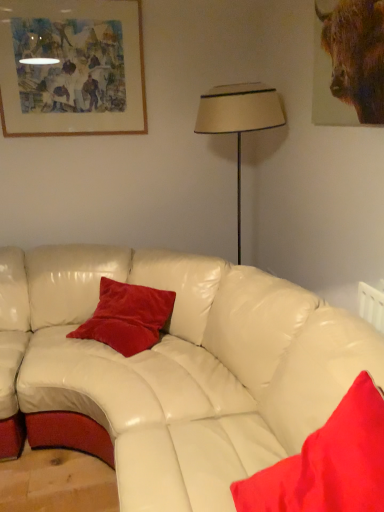
Describe the element at coordinates (348, 63) in the screenshot. I see `brown furry bull at upper right` at that location.

The height and width of the screenshot is (512, 384). I want to click on brown furry bull at upper right, so click(x=348, y=63).

What do you see at coordinates (71, 67) in the screenshot? Image resolution: width=384 pixels, height=512 pixels. I see `wooden framed artwork at upper left` at bounding box center [71, 67].

What do you see at coordinates (328, 463) in the screenshot? I see `velvet red pillow at lower right, the 1th pillow in the right-to-left sequence` at bounding box center [328, 463].

At what (x,y) coordinates should I click in order to perform the action: click on brown furry bull at upper right. Please return your answer as a coordinate pair (x, y). Looking at the image, I should click on (348, 63).

Is point (93, 126) more distant than point (350, 33)?

Yes, it is behind point (350, 33).

Locate an element on the screen. Image resolution: width=384 pixels, height=512 pixels. picture frame lying above the brown furry bull at upper right (from the image's perspective) is located at coordinates (71, 67).

Is wooden framed artwork at upper left placed right next to brown furry bull at upper right?

wooden framed artwork at upper left is not next to brown furry bull at upper right, and they're not touching.

Is beige fabric lampshade at center smaller than brown furry bull at upper right?

No, beige fabric lampshade at center is not smaller than brown furry bull at upper right.

This screenshot has height=512, width=384. In order to click on table lamp that appears below the brown furry bull at upper right (from a real-world perspective) in this screenshot , I will do `click(239, 119)`.

Is the position of beige fabric lampshade at center less distant than that of brown furry bull at upper right?

No.

Is brown furry bull at upper right at the right side of velvet red pillow at lower right, arranged as the 1th pillow when viewed from the front?

Yes.

In the scene shown: Does brown furry bull at upper right lie in front of velvet red pillow at lower right, the second pillow in the left-to-right sequence?

No, the depth of brown furry bull at upper right is greater than that of velvet red pillow at lower right, the second pillow in the left-to-right sequence.

Which of these two, brown furry bull at upper right or velvet red pillow at lower right, arranged as the 1th pillow when viewed from the front, is smaller?

brown furry bull at upper right.

How much distance is there between velvet red pillow at lower right, arranged as the 1th pillow when viewed from the front, and brown furry bull at upper right?

They are 3.97 feet apart.

Which of these two, velvet red pillow at lower right, arranged as the 1th pillow when viewed from the front, or brown furry bull at upper right, stands taller?

With more height is brown furry bull at upper right.

Is velvet red pillow at lower right, the 2th pillow when ordered from back to front, not inside brown furry bull at upper right?

That's correct, velvet red pillow at lower right, the 2th pillow when ordered from back to front, is outside of brown furry bull at upper right.

Consider the image. Can you confirm if velvet red pillow at lower right, the second pillow in the left-to-right sequence, is positioned to the left of brown furry bull at upper right?

Indeed, velvet red pillow at lower right, the second pillow in the left-to-right sequence, is positioned on the left side of brown furry bull at upper right.

Does point (141, 349) lie behind point (5, 33)?

No.

Is velvet red pillow at center, marked as the first pillow in a left-to-right arrangement, oriented away from wooden framed artwork at upper left?

No, velvet red pillow at center, marked as the first pillow in a left-to-right arrangement, is not facing away from wooden framed artwork at upper left.

Consider the image. Can you confirm if velvet red pillow at center, the 2th pillow when ordered from front to back, is taller than wooden framed artwork at upper left?

In fact, velvet red pillow at center, the 2th pillow when ordered from front to back, may be shorter than wooden framed artwork at upper left.

From the image's perspective, which is above, velvet red pillow at center, which ranks as the first pillow in back-to-front order, or brown furry bull at upper right?

brown furry bull at upper right, from the image's perspective.

Between velvet red pillow at center, the 2th pillow when ordered from front to back, and brown furry bull at upper right, which one appears on the left side from the viewer's perspective?

velvet red pillow at center, the 2th pillow when ordered from front to back.

From a real-world perspective, is velvet red pillow at center, which ranks as the first pillow in back-to-front order, below brown furry bull at upper right?

Yes.

Is velvet red pillow at center, the 2th pillow in the right-to-left sequence, positioned beyond the bounds of brown furry bull at upper right?

That's correct, velvet red pillow at center, the 2th pillow in the right-to-left sequence, is outside of brown furry bull at upper right.

Based on the photo, in the image, is brown furry bull at upper right positioned in front of or behind wooden framed artwork at upper left?

brown furry bull at upper right is positioned closer to the viewer than wooden framed artwork at upper left.

Which of these two, brown furry bull at upper right or wooden framed artwork at upper left, is thinner?

brown furry bull at upper right.

Is brown furry bull at upper right facing away from wooden framed artwork at upper left?

No, wooden framed artwork at upper left is not at the back of brown furry bull at upper right.

From the image's perspective, relative to wooden framed artwork at upper left, is brown furry bull at upper right above or below?

From the image's perspective, brown furry bull at upper right appears below wooden framed artwork at upper left.

Where is `picture frame on the left of brown furry bull at upper right`? Image resolution: width=384 pixels, height=512 pixels. picture frame on the left of brown furry bull at upper right is located at coordinates (71, 67).

Where is `bull to the right of beige fabric lampshade at center`? This screenshot has width=384, height=512. bull to the right of beige fabric lampshade at center is located at coordinates (348, 63).

When comparing their distances from brown furry bull at upper right, does velvet red pillow at center, marked as the first pillow in a left-to-right arrangement, or velvet red pillow at lower right, arranged as the 1th pillow when viewed from the front, seem closer?

velvet red pillow at lower right, arranged as the 1th pillow when viewed from the front, lies closer to brown furry bull at upper right than the other object.

Looking at the image, which one is located further to wooden framed artwork at upper left, velvet red pillow at center, which ranks as the first pillow in back-to-front order, or beige fabric lampshade at center?

velvet red pillow at center, which ranks as the first pillow in back-to-front order, lies further to wooden framed artwork at upper left than the other object.

Based on their spatial positions, is velvet red pillow at lower right, the second pillow in the left-to-right sequence, or wooden framed artwork at upper left closer to beige fabric lampshade at center?

wooden framed artwork at upper left is closer to beige fabric lampshade at center.

From the image, which object appears to be nearer to wooden framed artwork at upper left, velvet red pillow at lower right, arranged as the 1th pillow when viewed from the front, or brown furry bull at upper right?

brown furry bull at upper right lies closer to wooden framed artwork at upper left than the other object.

When comparing their distances from velvet red pillow at center, which ranks as the first pillow in back-to-front order, does wooden framed artwork at upper left or brown furry bull at upper right seem closer?

Based on the image, wooden framed artwork at upper left appears to be nearer to velvet red pillow at center, which ranks as the first pillow in back-to-front order.

From the picture: Considering their positions, is velvet red pillow at center, marked as the first pillow in a left-to-right arrangement, positioned further to brown furry bull at upper right than beige fabric lampshade at center?

velvet red pillow at center, marked as the first pillow in a left-to-right arrangement, is further to brown furry bull at upper right.

Estimate the real-world distances between objects in this image. Which object is further from velvet red pillow at center, the 2th pillow in the right-to-left sequence, brown furry bull at upper right or wooden framed artwork at upper left?

brown furry bull at upper right lies further to velvet red pillow at center, the 2th pillow in the right-to-left sequence, than the other object.

Which object lies further to the anchor point wooden framed artwork at upper left, velvet red pillow at lower right, the 2th pillow when ordered from back to front, or velvet red pillow at center, the 2th pillow in the right-to-left sequence?

Based on the image, velvet red pillow at lower right, the 2th pillow when ordered from back to front, appears to be further to wooden framed artwork at upper left.

This screenshot has width=384, height=512. What are the coordinates of `pillow between wooden framed artwork at upper left and velvet red pillow at lower right, the 1th pillow in the right-to-left sequence, in the up-down direction` in the screenshot? It's located at (127, 317).

This screenshot has height=512, width=384. I want to click on table lamp between wooden framed artwork at upper left and brown furry bull at upper right in the horizontal direction, so click(x=239, y=119).

Image resolution: width=384 pixels, height=512 pixels. Identify the location of bull between wooden framed artwork at upper left and velvet red pillow at center, which ranks as the first pillow in back-to-front order, in the up-down direction. (348, 63).

The width and height of the screenshot is (384, 512). What are the coordinates of `table lamp between brown furry bull at upper right and velvet red pillow at lower right, the 2th pillow when ordered from back to front, vertically` in the screenshot? It's located at (239, 119).